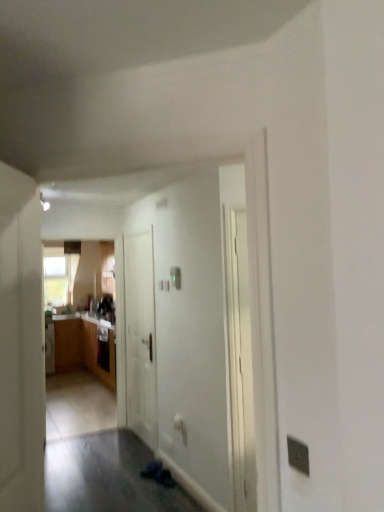
Where is `wooden cabinet at left`? This screenshot has height=512, width=384. wooden cabinet at left is located at coordinates (68, 345).

The image size is (384, 512). I want to click on white matte door at center, which appears as the 1th door when viewed from the back, so click(x=140, y=337).

The height and width of the screenshot is (512, 384). Find the location of `white matte door at left, arranged as the first door when viewed from the front`. white matte door at left, arranged as the first door when viewed from the front is located at coordinates (21, 362).

Locate an element on the screen. The height and width of the screenshot is (512, 384). wooden cabinet at left is located at coordinates (68, 345).

Does white matte door at center, acting as the 2th door starting from the front, touch wooden cabinet at left?

No, white matte door at center, acting as the 2th door starting from the front, is not touching wooden cabinet at left.

From the image's perspective, is white matte door at center, which appears as the 1th door when viewed from the back, above or below wooden cabinet at left?

Based on their image positions, white matte door at center, which appears as the 1th door when viewed from the back, is located above wooden cabinet at left.

From their relative heights in the image, would you say white matte door at center, acting as the 2th door starting from the front, is taller or shorter than wooden cabinet at left?

Clearly, white matte door at center, acting as the 2th door starting from the front, is taller compared to wooden cabinet at left.

Does point (154, 430) come closer to viewer compared to point (8, 381)?

No, it is not.

Measure the distance from white matte door at center, which appears as the 1th door when viewed from the back, to white matte door at left, which is the 2th door in back-to-front order.

white matte door at center, which appears as the 1th door when viewed from the back, is 2.51 meters from white matte door at left, which is the 2th door in back-to-front order.

Is white matte door at center, which appears as the 1th door when viewed from the back, outside of white matte door at left, which is the 2th door in back-to-front order?

Yes.

Is white matte door at center, which appears as the 1th door when viewed from the back, shorter than white matte door at left, arranged as the first door when viewed from the front?

In fact, white matte door at center, which appears as the 1th door when viewed from the back, may be taller than white matte door at left, arranged as the first door when viewed from the front.

Is white matte door at left, arranged as the first door when viewed from the front, positioned far away from wooden cabinet at left?

Yes, white matte door at left, arranged as the first door when viewed from the front, is far from wooden cabinet at left.

Is white matte door at left, which is the 2th door in back-to-front order, at the left side of wooden cabinet at left?

No.

From a real-world perspective, relative to wooden cabinet at left, is white matte door at left, which is the 2th door in back-to-front order, vertically above or below?

white matte door at left, which is the 2th door in back-to-front order, is situated higher than wooden cabinet at left in the real world.

Is white matte door at left, which is the 2th door in back-to-front order, further to the viewer compared to wooden cabinet at left?

No, white matte door at left, which is the 2th door in back-to-front order, is in front of wooden cabinet at left.

Does wooden cabinet at left have a lesser height compared to white matte door at left, which is the 2th door in back-to-front order?

Yes, wooden cabinet at left is shorter than white matte door at left, which is the 2th door in back-to-front order.

Is wooden cabinet at left far from white matte door at left, which is the 2th door in back-to-front order?

Yes, wooden cabinet at left is far from white matte door at left, which is the 2th door in back-to-front order.

From a real-world perspective, which object stands above the other?

From a 3D spatial view, white matte door at left, which is the 2th door in back-to-front order, is above.

Visually, is wooden cabinet at left positioned to the left or to the right of white matte door at left, arranged as the first door when viewed from the front?

wooden cabinet at left is positioned on white matte door at left, arranged as the first door when viewed from the front,'s left side.

Considering the sizes of wooden cabinet at left and white matte door at center, acting as the 2th door starting from the front, in the image, is wooden cabinet at left taller or shorter than white matte door at center, acting as the 2th door starting from the front,?

Considering their sizes, wooden cabinet at left has less height than white matte door at center, acting as the 2th door starting from the front.

How much distance is there between wooden cabinet at left and white matte door at center, acting as the 2th door starting from the front?

11.42 feet.

Is wooden cabinet at left positioned with its back to white matte door at center, which appears as the 1th door when viewed from the back?

wooden cabinet at left is not turned away from white matte door at center, which appears as the 1th door when viewed from the back.

Are wooden cabinet at left and white matte door at center, which appears as the 1th door when viewed from the back, beside each other?

No, wooden cabinet at left is not touching white matte door at center, which appears as the 1th door when viewed from the back.

Relative to white matte door at center, which appears as the 1th door when viewed from the back, is white matte door at left, which is the 2th door in back-to-front order, in front or behind?

In the image, white matte door at left, which is the 2th door in back-to-front order, appears in front of white matte door at center, which appears as the 1th door when viewed from the back.

From the image's perspective, is white matte door at left, which is the 2th door in back-to-front order, positioned above or below white matte door at center, acting as the 2th door starting from the front?

white matte door at left, which is the 2th door in back-to-front order, is above white matte door at center, acting as the 2th door starting from the front.

Can you tell me how much white matte door at left, which is the 2th door in back-to-front order, and white matte door at center, acting as the 2th door starting from the front, differ in facing direction?

The angular difference between white matte door at left, which is the 2th door in back-to-front order, and white matte door at center, acting as the 2th door starting from the front, is 150 degrees.

You are a GUI agent. You are given a task and a screenshot of the screen. Output one action in this format:
    pyautogui.click(x=<x>, y=<y>)
    Task: Click on the door behind the white matte door at left, arranged as the first door when viewed from the front
    The height and width of the screenshot is (512, 384).
    Given the screenshot: What is the action you would take?
    pyautogui.click(x=140, y=337)

You are a GUI agent. You are given a task and a screenshot of the screen. Output one action in this format:
    pyautogui.click(x=<x>, y=<y>)
    Task: Click on the cabinetry below the white matte door at center, acting as the 2th door starting from the front (from the image's perspective)
    Image resolution: width=384 pixels, height=512 pixels.
    Given the screenshot: What is the action you would take?
    pyautogui.click(x=68, y=345)

Locate an element on the screen. This screenshot has height=512, width=384. door on the left side of white matte door at center, which appears as the 1th door when viewed from the back is located at coordinates (21, 362).

From the image, which object appears to be nearer to white matte door at left, arranged as the first door when viewed from the front, wooden cabinet at left or white matte door at center, which appears as the 1th door when viewed from the back?

white matte door at center, which appears as the 1th door when viewed from the back, is closer to white matte door at left, arranged as the first door when viewed from the front.

Which object lies nearer to the anchor point white matte door at center, acting as the 2th door starting from the front, white matte door at left, arranged as the first door when viewed from the front, or wooden cabinet at left?

Based on the image, white matte door at left, arranged as the first door when viewed from the front, appears to be nearer to white matte door at center, acting as the 2th door starting from the front.

Looking at the image, which one is located further to wooden cabinet at left, white matte door at center, which appears as the 1th door when viewed from the back, or white matte door at left, which is the 2th door in back-to-front order?

white matte door at left, which is the 2th door in back-to-front order, lies further to wooden cabinet at left than the other object.

When comparing their distances from white matte door at center, acting as the 2th door starting from the front, does wooden cabinet at left or white matte door at left, which is the 2th door in back-to-front order, seem further?

wooden cabinet at left lies further to white matte door at center, acting as the 2th door starting from the front, than the other object.

Considering their positions, is white matte door at left, arranged as the first door when viewed from the front, positioned closer to wooden cabinet at left than white matte door at center, which appears as the 1th door when viewed from the back?

white matte door at center, which appears as the 1th door when viewed from the back, is closer to wooden cabinet at left.

When comparing their distances from white matte door at left, arranged as the first door when viewed from the front, does white matte door at center, which appears as the 1th door when viewed from the back, or wooden cabinet at left seem closer?

Among the two, white matte door at center, which appears as the 1th door when viewed from the back, is located nearer to white matte door at left, arranged as the first door when viewed from the front.

The width and height of the screenshot is (384, 512). I want to click on door between white matte door at left, which is the 2th door in back-to-front order, and wooden cabinet at left from front to back, so click(x=140, y=337).